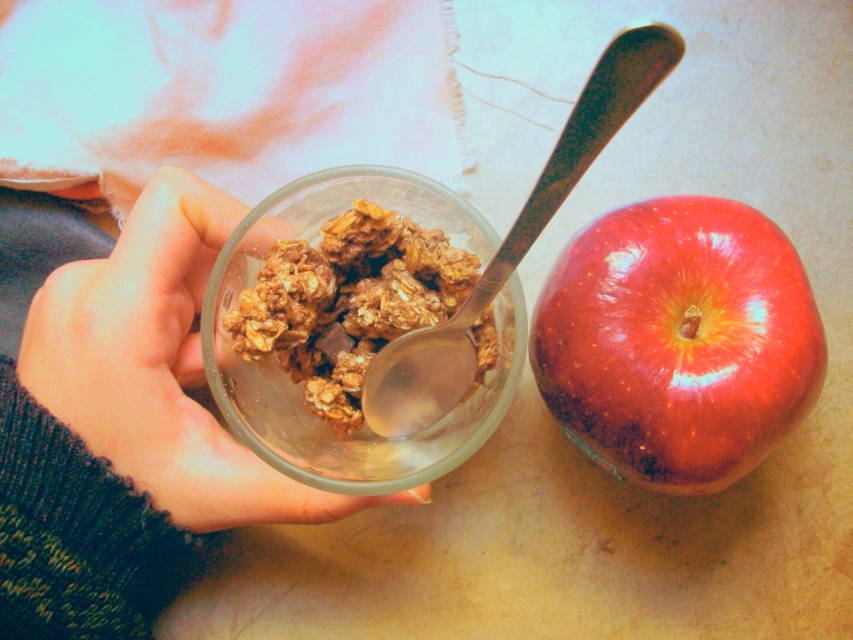
Question: Among these points, which one is nearest to the camera?

Choices:
 (A) (244, 349)
 (B) (791, 371)
 (C) (585, 100)
 (D) (59, 369)

Answer: (C)

Question: Where is translucent plastic cup at center located in relation to satin silver spoon at center in the image?

Choices:
 (A) above
 (B) below

Answer: (B)

Question: Which point is farther from the camera taking this photo?

Choices:
 (A) (141, 372)
 (B) (265, 314)

Answer: (A)

Question: Which of the following is the farthest from the observer?

Choices:
 (A) satin silver spoon at center
 (B) shiny red apple at right
 (C) golden crunchy granola at center

Answer: (B)

Question: Is golden crunchy granola at center wider than satin silver spoon at center?

Choices:
 (A) yes
 (B) no

Answer: (A)

Question: Does shiny red apple at right lie in front of golden crunchy granola at center?

Choices:
 (A) no
 (B) yes

Answer: (A)